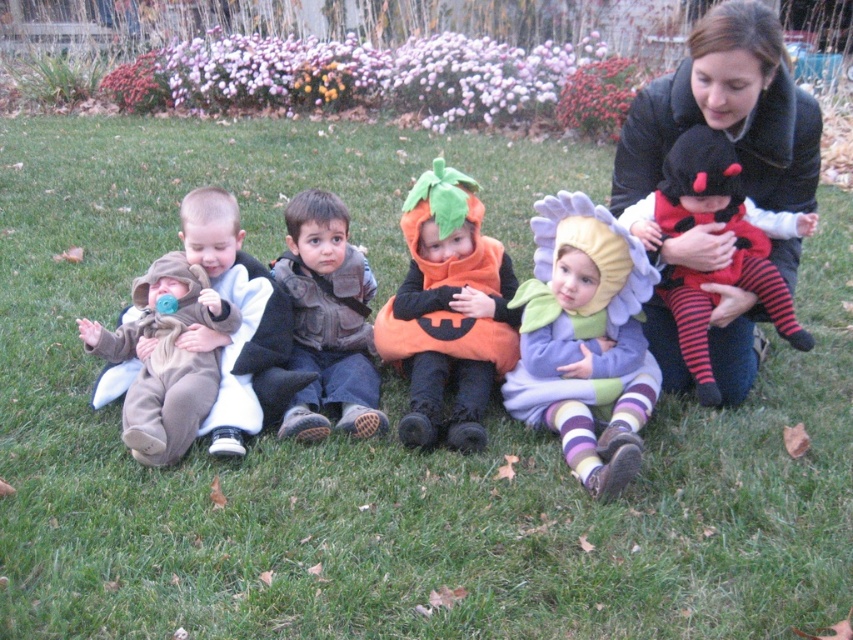
Question: Which object is the closest to the purple fabric flower at center?

Choices:
 (A) orange fabric pumpkin at center
 (B) black fuzzy coat at upper right
 (C) brown suede vest at center

Answer: (A)

Question: Which point is closer to the camera taking this photo?

Choices:
 (A) (782, 152)
 (B) (590, 376)
 (C) (496, 371)

Answer: (A)

Question: Does purple fabric flower at center come behind orange fabric pumpkin at center?

Choices:
 (A) no
 (B) yes

Answer: (A)

Question: Is brown suede vest at center smaller than brown fleece onesie at left?

Choices:
 (A) yes
 (B) no

Answer: (B)

Question: Does black fuzzy coat at upper right have a lesser width compared to purple fabric flower at center?

Choices:
 (A) no
 (B) yes

Answer: (A)

Question: Which of the following is the closest to the observer?

Choices:
 (A) brown suede vest at center
 (B) orange fabric pumpkin at center
 (C) purple fabric flower at center

Answer: (C)